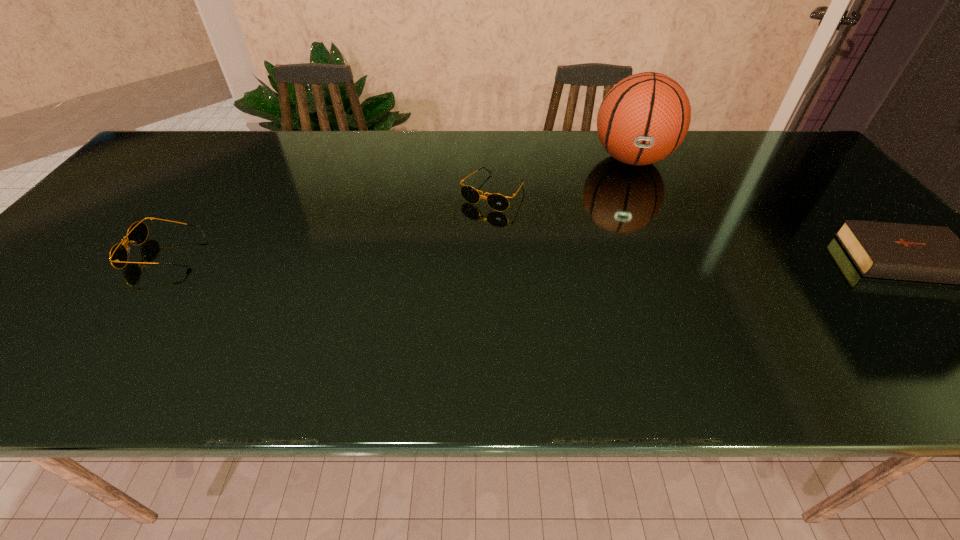
Identify the location of free spot on the desktop that is between the nearer sunglasses and the rightmost object and is positioned on the side where the inflation valve is located. (636, 257).

Find the location of a particular element. vacant space on the desktop that is between the leftmost object and the rightmost object and is positioned on the lenses of the right sunglasses is located at coordinates (444, 255).